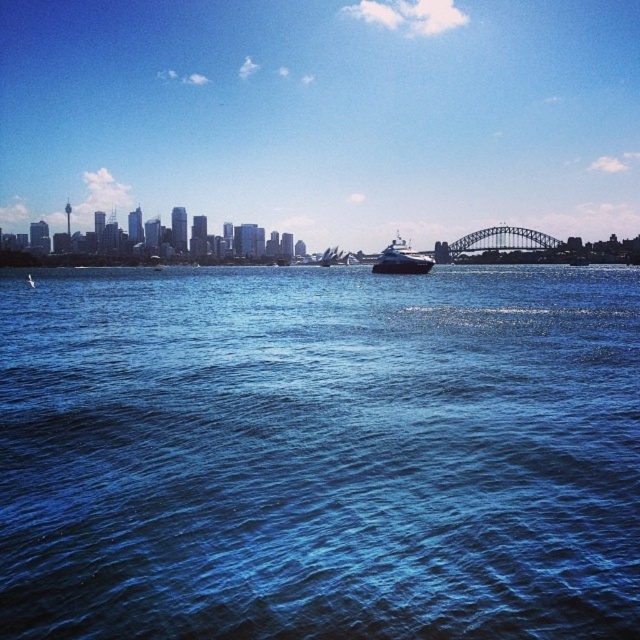
Question: Is blue liquid water at center smaller than shiny black yacht at center?

Choices:
 (A) yes
 (B) no

Answer: (B)

Question: Which point is closer to the camera?

Choices:
 (A) (397, 262)
 (B) (211, 417)

Answer: (B)

Question: Can you confirm if blue liquid water at center is positioned to the right of shiny black yacht at center?

Choices:
 (A) no
 (B) yes

Answer: (A)

Question: Which of the following is the closest to the observer?

Choices:
 (A) blue liquid water at center
 (B) shiny black yacht at center

Answer: (A)

Question: Which of the following is the closest to the observer?

Choices:
 (A) blue liquid water at center
 (B) shiny black yacht at center

Answer: (A)

Question: Is blue liquid water at center thinner than shiny black yacht at center?

Choices:
 (A) no
 (B) yes

Answer: (A)